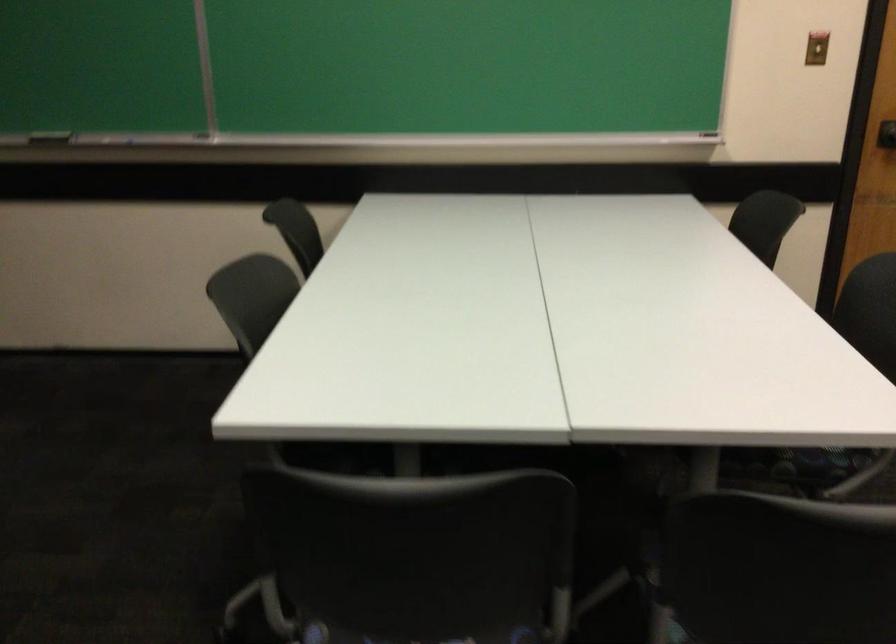
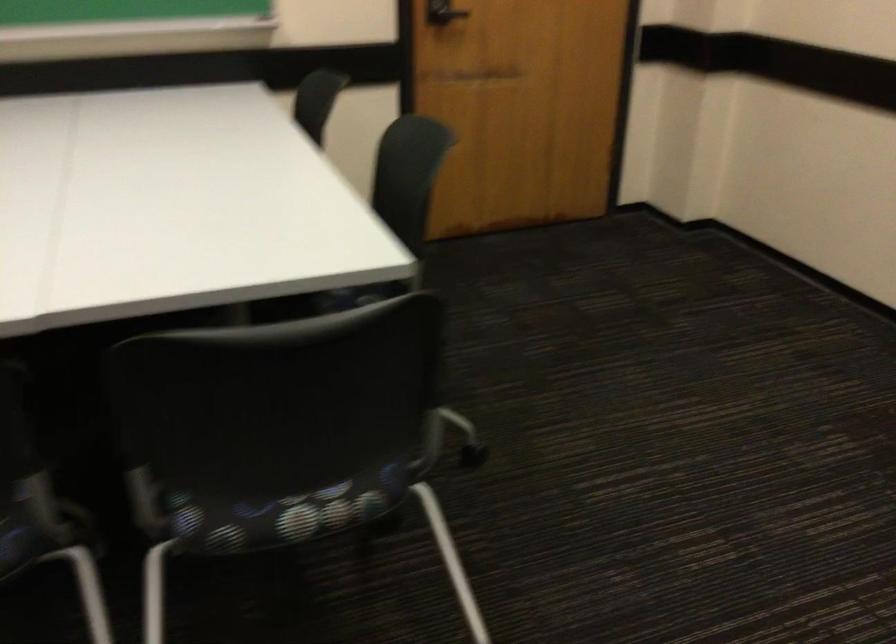
Question: Based on the continuous images, in which direction is the camera rotating? Reply with the corresponding letter.

Choices:
 (A) Left
 (B) Right
 (C) Up
 (D) Down

Answer: (B)